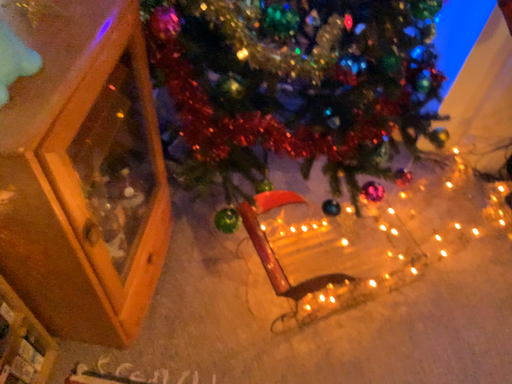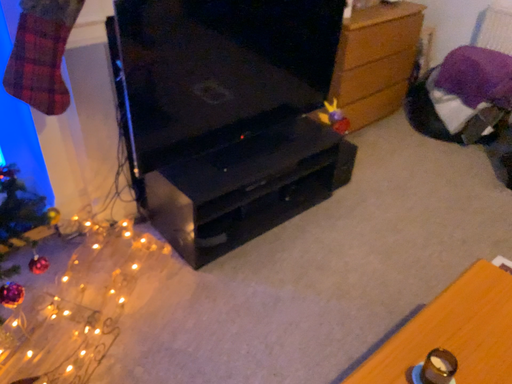
Question: Which way did the camera rotate in the video?

Choices:
 (A) rotated upward
 (B) rotated downward

Answer: (A)